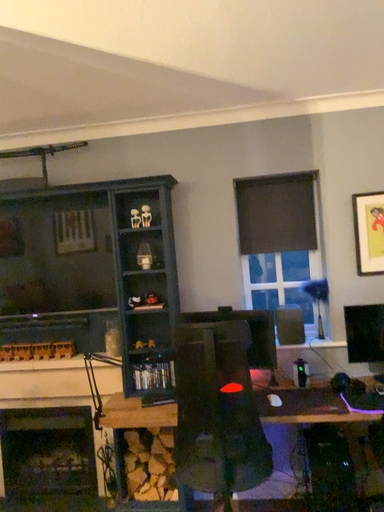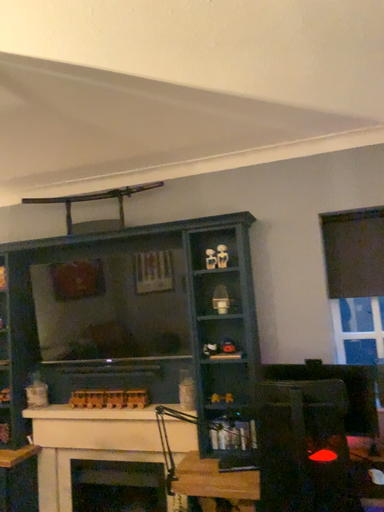
Question: Which way did the camera rotate in the video?

Choices:
 (A) rotated right
 (B) rotated left

Answer: (B)